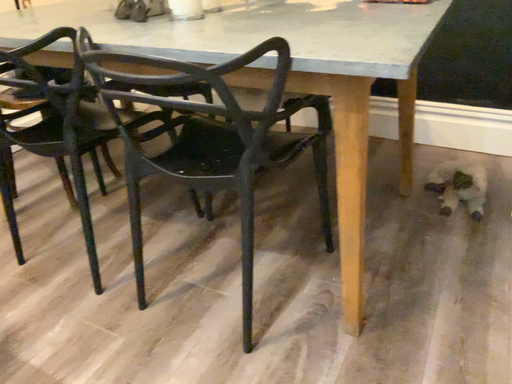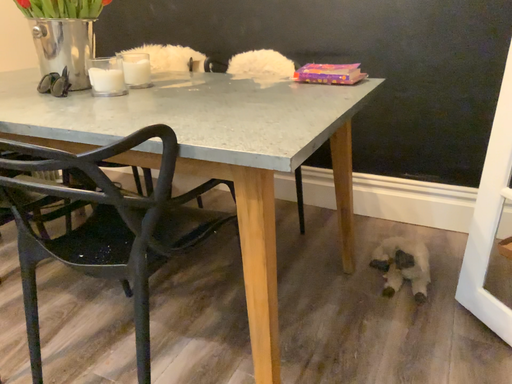
Question: Which way did the camera rotate in the video?

Choices:
 (A) rotated upward
 (B) rotated downward

Answer: (A)